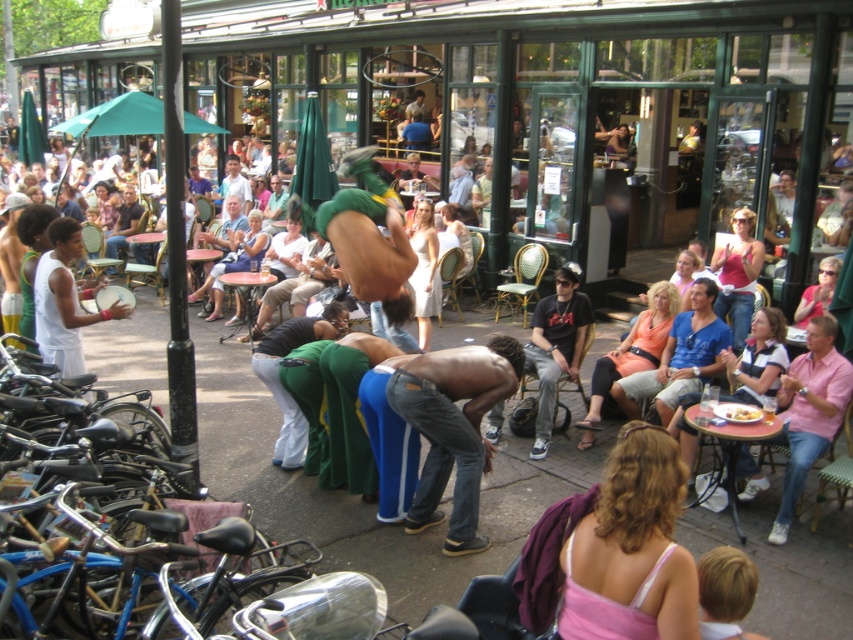
You are a photographer trying to capture the denim jeans at center in your shot. Given that the denim jeans at center is located at point (453, 428), where should you aim your camera to ensure it is centered in the frame?

The denim jeans at center is already located at point (453, 428), so aiming your camera at that coordinate will ensure it is centered in the frame.

Where is the denim jeans at center located in the image?

The denim jeans at center is located at point (453, 428).

You are a photographer standing at the edge of the scene. You want to take a photo that includes both the denim jeans at center and the yellowish matte plate at lower center. Given that your camera has a maximum focus range of 5 feet, will you be able to capture both objects in focus without moving?

The denim jeans at center and yellowish matte plate at lower center are 5.29 feet apart from each other. Since the distance exceeds the camera maximum focus range of 5 feet, you will not be able to capture both objects in focus without moving.